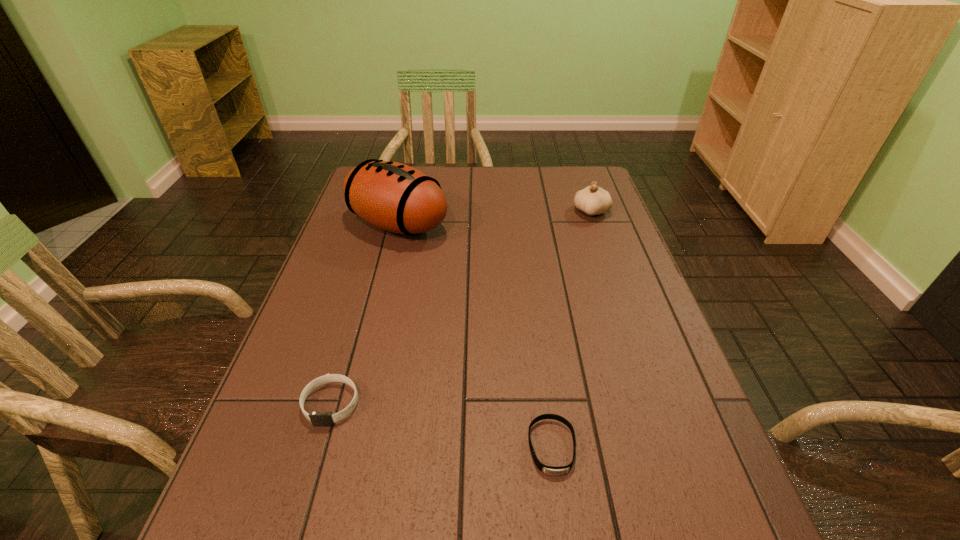
Locate an element on the screen. Image resolution: width=960 pixels, height=540 pixels. vacant region between the third shortest object and the shorter wristband is located at coordinates (571, 329).

Identify the location of unoccupied area between the second shortest object and the shortest object. (442, 426).

This screenshot has height=540, width=960. What are the coordinates of `vacant region between the garlic and the tallest object` in the screenshot? It's located at (494, 218).

This screenshot has height=540, width=960. I want to click on free space between the third object from left to right and the rightmost object, so click(571, 329).

You are a GUI agent. You are given a task and a screenshot of the screen. Output one action in this format:
    pyautogui.click(x=<x>, y=<y>)
    Task: Click on the free point between the third shortest object and the second shortest object
    Image resolution: width=960 pixels, height=540 pixels.
    Given the screenshot: What is the action you would take?
    pyautogui.click(x=461, y=308)

Find the location of a particular element. free spot between the right wristband and the second tallest object is located at coordinates (571, 329).

This screenshot has height=540, width=960. Identify the location of free area in between the shortest object and the second tallest object. coord(571,329).

Where is `free area in between the rightmost object and the shorter wristband`? The image size is (960, 540). free area in between the rightmost object and the shorter wristband is located at coordinates (571, 329).

Identify the location of free space that is in between the tallest object and the second object from right to left. (475, 335).

Identify the location of object that is the closest to the second shortest object. (550, 470).